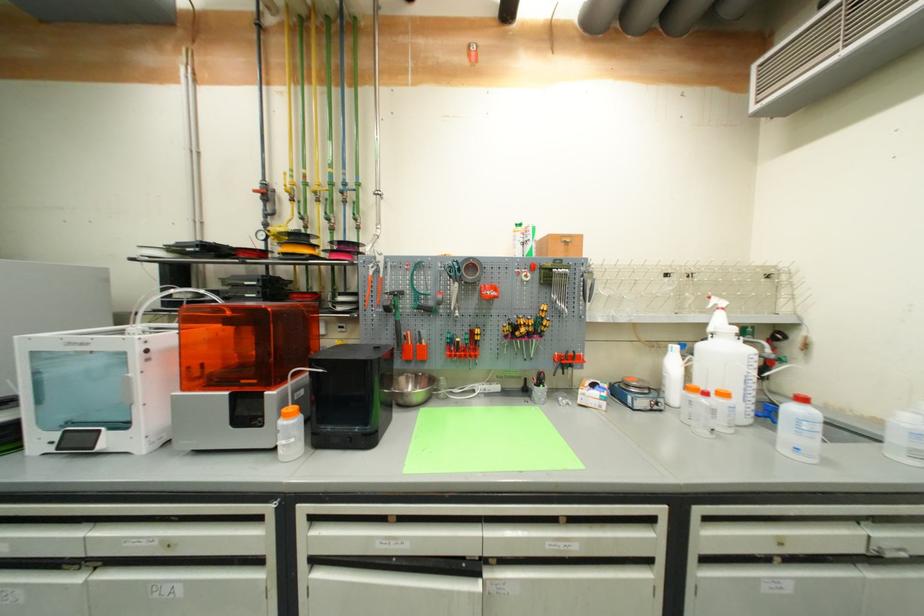
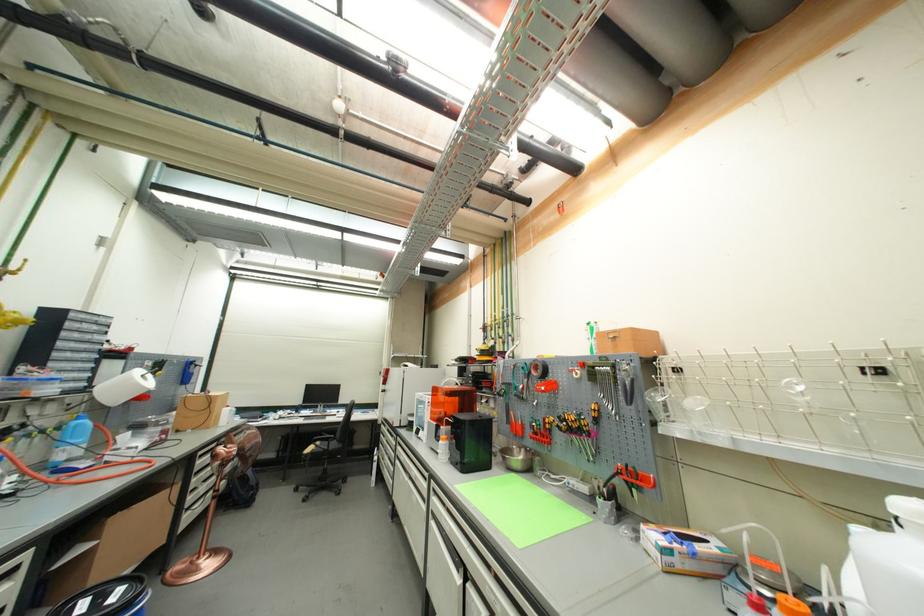
In the second image, find the point that corresponds to (x=492, y=294) in the first image.

(544, 390)